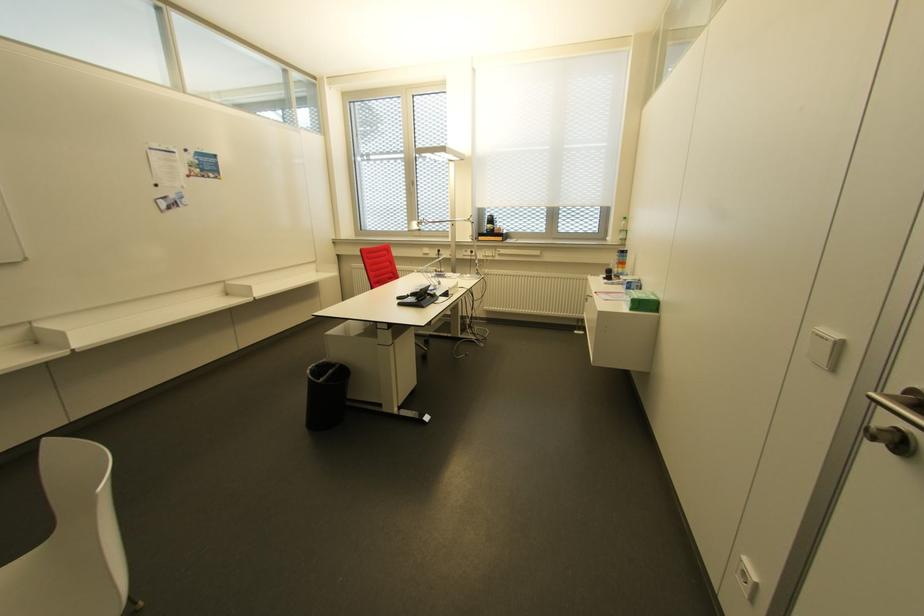
What do you see at coordinates (61, 578) in the screenshot? This screenshot has width=924, height=616. I see `a white chair sitting surface` at bounding box center [61, 578].